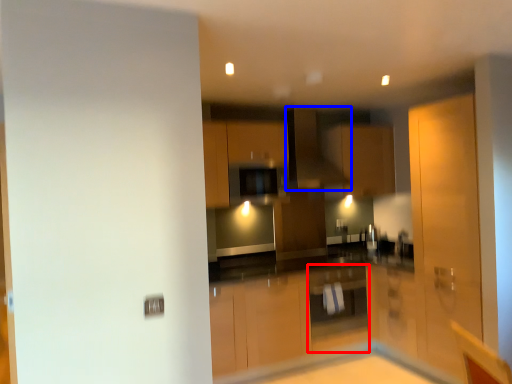
Question: Which object appears farthest to the camera in this image, cabinetry (highlighted by a red box) or exhaust hood (highlighted by a blue box)?

Choices:
 (A) cabinetry
 (B) exhaust hood

Answer: (B)